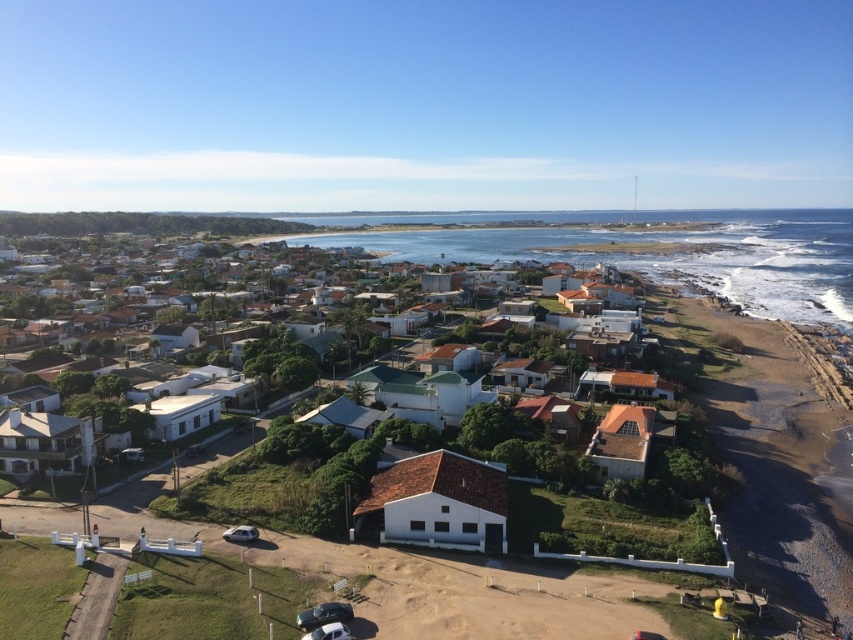
You are a delivery drone flying over the coastal area shown in the image. Your GPS coordinates are at point A, which is at the beach edge. You need to deliver a package to the white matte house at center. According to the coordinates, in which direction should you fly to reach the house from your current position?

The white matte house at center is located at coordinates point (410,440). Since you are at the beach edge, which is likely at a lower coordinate along the y or x axis, you should fly towards the coordinates where both x and y increase to reach the house.

You are a drone operator flying over the coastal area. Your task is to capture a photo of the white matte house at center and the blue water at center. From the drone camera perspective, which object will appear closer to the top of the photo?

The white matte house at center is in front of the blue water at center, so from the drone camera perspective, the white matte house at center will appear closer to the top of the photo.